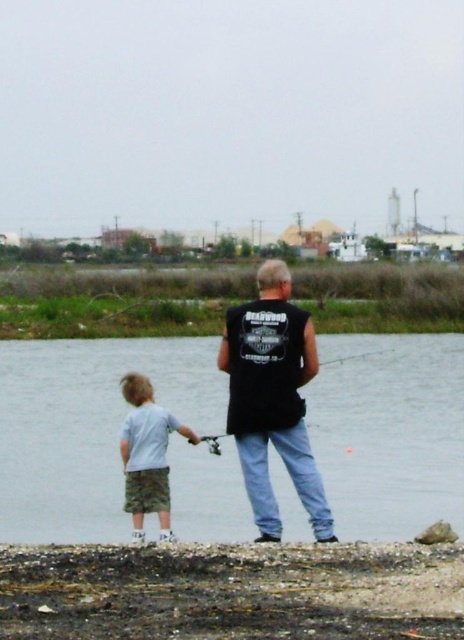
Who is lower down, clear water at center or light gray cotton shirt at lower left?

light gray cotton shirt at lower left

Is point (234, 454) positioned after point (130, 493)?

Yes, point (234, 454) is farther from viewer.

What do you see at coordinates (87, 428) in the screenshot?
I see `clear water at center` at bounding box center [87, 428].

Locate an element on the screen. This screenshot has width=464, height=640. clear water at center is located at coordinates (87, 428).

Is clear water at center to the left of black sleeveless shirt at center from the viewer's perspective?

Correct, you'll find clear water at center to the left of black sleeveless shirt at center.

Does point (203, 508) come in front of point (327, 540)?

No, it is not.

The height and width of the screenshot is (640, 464). Find the location of `clear water at center`. clear water at center is located at coordinates (87, 428).

Between black sleeveless shirt at center and matte black fishing pole at center, which one appears on the left side from the viewer's perspective?

From the viewer's perspective, black sleeveless shirt at center appears more on the left side.

Is black sleeveless shirt at center wider than matte black fishing pole at center?

No, black sleeveless shirt at center is not wider than matte black fishing pole at center.

Identify the location of black sleeveless shirt at center. (272, 397).